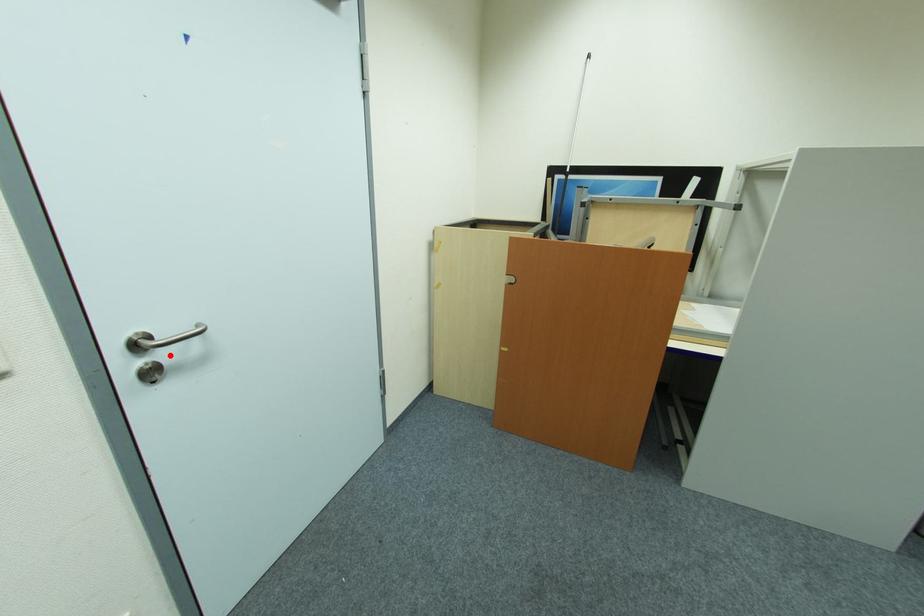
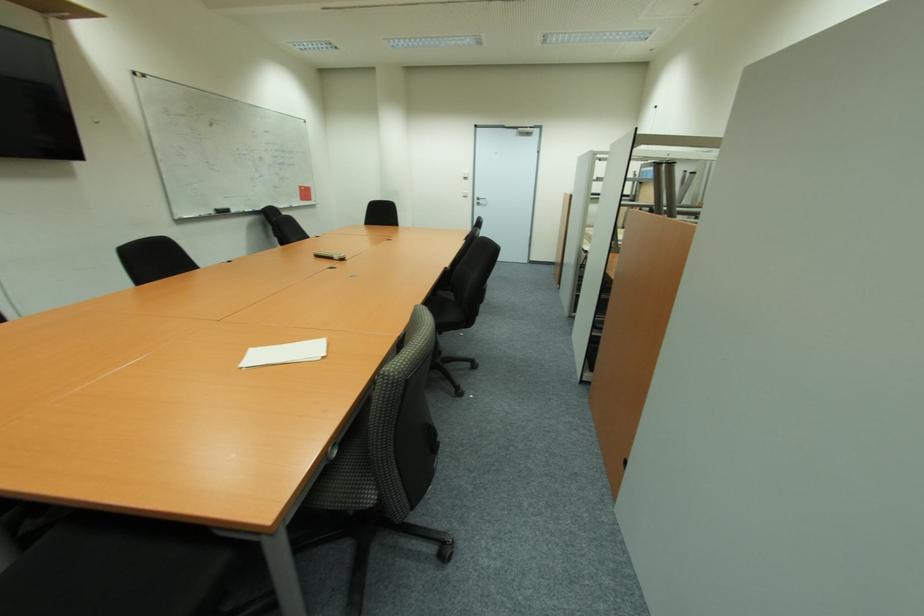
Question: I am providing you with two images of the same scene from different viewpoints. Given a red point in image1, look at the same physical point in image2. Is it:

Choices:
 (A) Closer to the viewpoint
 (B) Farther from the viewpoint

Answer: (A)